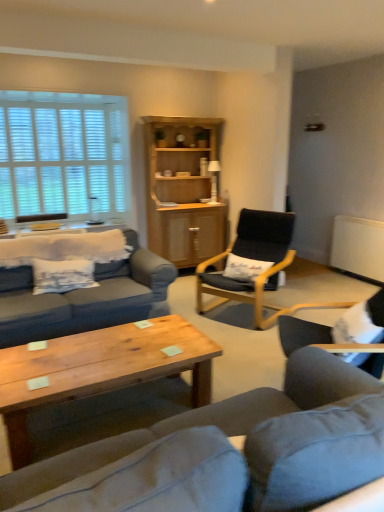
Question: Considering the relative positions of wooden table at left and matte gray couch at center in the image provided, is wooden table at left to the left of matte gray couch at center from the viewer's perspective?

Choices:
 (A) yes
 (B) no

Answer: (A)

Question: Does wooden table at left have a larger size compared to matte gray couch at center?

Choices:
 (A) yes
 (B) no

Answer: (B)

Question: From a real-world perspective, is wooden table at left below matte gray couch at center?

Choices:
 (A) no
 (B) yes

Answer: (A)

Question: Is wooden table at left smaller than matte gray couch at center?

Choices:
 (A) no
 (B) yes

Answer: (B)

Question: From the image's perspective, is wooden table at left under matte gray couch at center?

Choices:
 (A) no
 (B) yes

Answer: (A)

Question: Is wooden table at left completely or partially outside of matte gray couch at center?

Choices:
 (A) no
 (B) yes

Answer: (B)

Question: Is white fur chair at lower right, acting as the 2th chair starting from the back, touching white wooden blinds at upper left?

Choices:
 (A) no
 (B) yes

Answer: (A)

Question: Considering the relative sizes of white fur chair at lower right, arranged as the first chair when viewed from the front, and white wooden blinds at upper left in the image provided, is white fur chair at lower right, arranged as the first chair when viewed from the front, wider than white wooden blinds at upper left?

Choices:
 (A) no
 (B) yes

Answer: (B)

Question: From the image's perspective, is white fur chair at lower right, arranged as the first chair when viewed from the front, located above white wooden blinds at upper left?

Choices:
 (A) no
 (B) yes

Answer: (A)

Question: Is white fur chair at lower right, arranged as the first chair when viewed from the front, positioned behind white wooden blinds at upper left?

Choices:
 (A) yes
 (B) no

Answer: (B)

Question: Is white fur chair at lower right, acting as the 2th chair starting from the back, positioned before white wooden blinds at upper left?

Choices:
 (A) no
 (B) yes

Answer: (B)

Question: Does white fur chair at lower right, arranged as the first chair when viewed from the front, turn towards white wooden blinds at upper left?

Choices:
 (A) no
 (B) yes

Answer: (A)

Question: Is white wooden blinds at upper left smaller than wooden table at left?

Choices:
 (A) yes
 (B) no

Answer: (B)